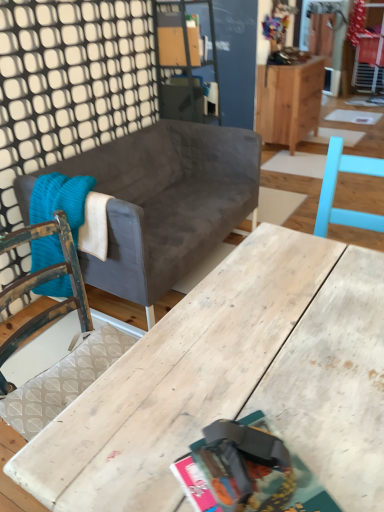
Identify the location of free point to the right of matte paper magazine at center. (343, 450).